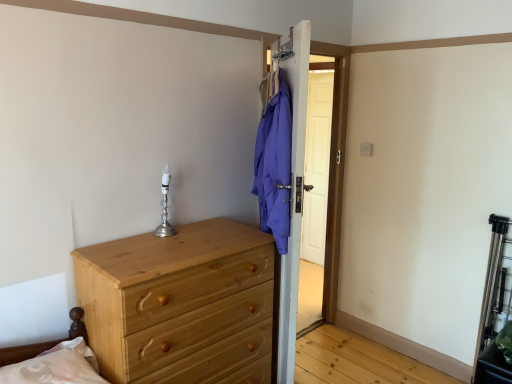
Question: Is natural wood chest of drawers at lower left turned away from silver metallic candle holder at center?

Choices:
 (A) yes
 (B) no

Answer: (B)

Question: From a real-world perspective, is natural wood chest of drawers at lower left positioned over silver metallic candle holder at center based on gravity?

Choices:
 (A) no
 (B) yes

Answer: (A)

Question: Would you say natural wood chest of drawers at lower left contains silver metallic candle holder at center?

Choices:
 (A) yes
 (B) no

Answer: (B)

Question: From a real-world perspective, is natural wood chest of drawers at lower left positioned under silver metallic candle holder at center based on gravity?

Choices:
 (A) no
 (B) yes

Answer: (B)

Question: Could you tell me if natural wood chest of drawers at lower left is turned towards silver metallic candle holder at center?

Choices:
 (A) yes
 (B) no

Answer: (B)

Question: From the image's perspective, is natural wood chest of drawers at lower left positioned above or below silver metallic candle holder at center?

Choices:
 (A) above
 (B) below

Answer: (B)

Question: Would you say natural wood chest of drawers at lower left is to the left or to the right of silver metallic candle holder at center in the picture?

Choices:
 (A) left
 (B) right

Answer: (B)

Question: Looking at the image, does natural wood chest of drawers at lower left seem bigger or smaller compared to silver metallic candle holder at center?

Choices:
 (A) small
 (B) big

Answer: (B)

Question: Considering the positions of natural wood chest of drawers at lower left and silver metallic candle holder at center in the image, is natural wood chest of drawers at lower left wider or thinner than silver metallic candle holder at center?

Choices:
 (A) thin
 (B) wide

Answer: (B)

Question: Based on their sizes in the image, would you say natural wood chest of drawers at lower left is bigger or smaller than brown wooden bed frame at lower left?

Choices:
 (A) big
 (B) small

Answer: (A)

Question: From the image's perspective, is natural wood chest of drawers at lower left above or below brown wooden bed frame at lower left?

Choices:
 (A) below
 (B) above

Answer: (A)

Question: Visually, is natural wood chest of drawers at lower left positioned to the left or to the right of brown wooden bed frame at lower left?

Choices:
 (A) left
 (B) right

Answer: (B)

Question: Is natural wood chest of drawers at lower left wider or thinner than brown wooden bed frame at lower left?

Choices:
 (A) thin
 (B) wide

Answer: (B)

Question: From a real-world perspective, relative to silver metallic candle holder at center, is brown wooden bed frame at lower left vertically above or below?

Choices:
 (A) below
 (B) above

Answer: (A)

Question: Choose the correct answer: Is brown wooden bed frame at lower left inside silver metallic candle holder at center or outside it?

Choices:
 (A) outside
 (B) inside

Answer: (A)